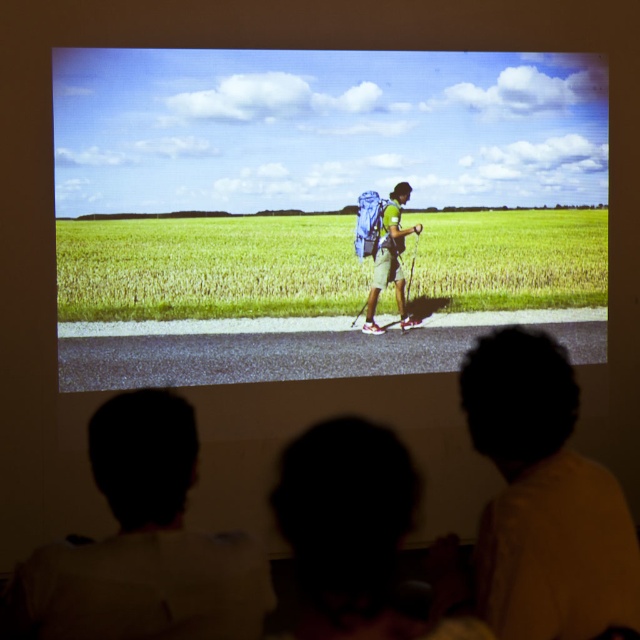
Based on the scene described, which object is wider, the silhouette hair at lower left or the green matte backpack at center?

The silhouette hair at lower left might be wider than the green matte backpack at center according to the description.

You are a delivery person who needs to place two green backpacks in a storage box that can only hold items within 30 inches in length. The two backpacks are the green fabric backpack at center and the green matte backpack at center. Can both backpacks fit side by side in the box?

The green fabric backpack at center is 27.78 inches away from green matte backpack at center. Since the distance between them is less than the 30 inches limit, both backpacks can fit side by side in the storage box.

You are a delivery robot that needs to place a package between the green grass at center and the green matte backpack at center. Can you fit the package in the space between them if the package is 19 inches long?

The distance between the green grass at center and the green matte backpack at center is 18.99 inches. Since the package is 19 inches long, it cannot fit in the space between them as it is slightly longer than the available gap.